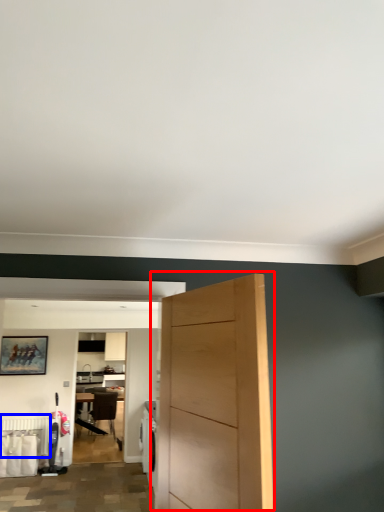
Question: Which of the following is the farthest to the observer, door (highlighted by a red box) or radiator (highlighted by a blue box)?

Choices:
 (A) door
 (B) radiator

Answer: (B)